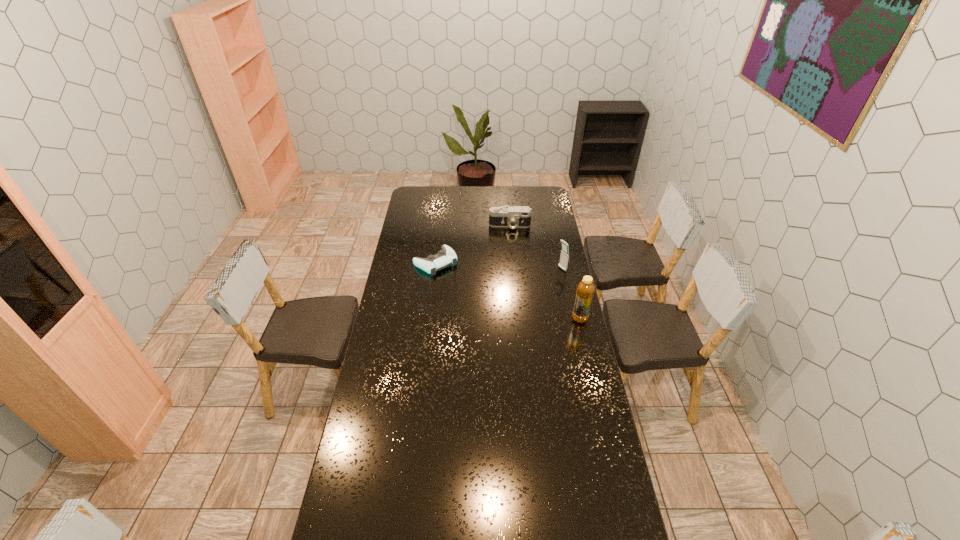
This screenshot has height=540, width=960. Find the location of `the shortest object`. the shortest object is located at coordinates (446, 256).

Find the location of a particular element. the leftmost object is located at coordinates 446,256.

Where is `the nearest object`? This screenshot has width=960, height=540. the nearest object is located at coordinates (585, 290).

The width and height of the screenshot is (960, 540). Find the location of `the tallest object`. the tallest object is located at coordinates pyautogui.click(x=585, y=290).

The height and width of the screenshot is (540, 960). Find the location of `the farthest object`. the farthest object is located at coordinates (514, 217).

Image resolution: width=960 pixels, height=540 pixels. Identify the location of the second shortest object. (514, 217).

You are a GUI agent. You are given a task and a screenshot of the screen. Output one action in this format:
    pyautogui.click(x=<x>, y=<y>)
    Task: Click on the second tallest object
    This screenshot has width=960, height=540.
    Given the screenshot: What is the action you would take?
    pyautogui.click(x=564, y=257)

You are a GUI agent. You are given a task and a screenshot of the screen. Output one action in this format:
    pyautogui.click(x=<x>, y=<y>)
    Task: Click on the vacant space located 0.190m on the back of the shortest object
    
    Given the screenshot: What is the action you would take?
    pyautogui.click(x=440, y=229)

This screenshot has height=540, width=960. I want to click on vacant space located on the front of the bottle, so click(585, 340).

This screenshot has height=540, width=960. In order to click on free point located 0.170m on the lens of the third tallest object in this screenshot , I will do pyautogui.click(x=510, y=249).